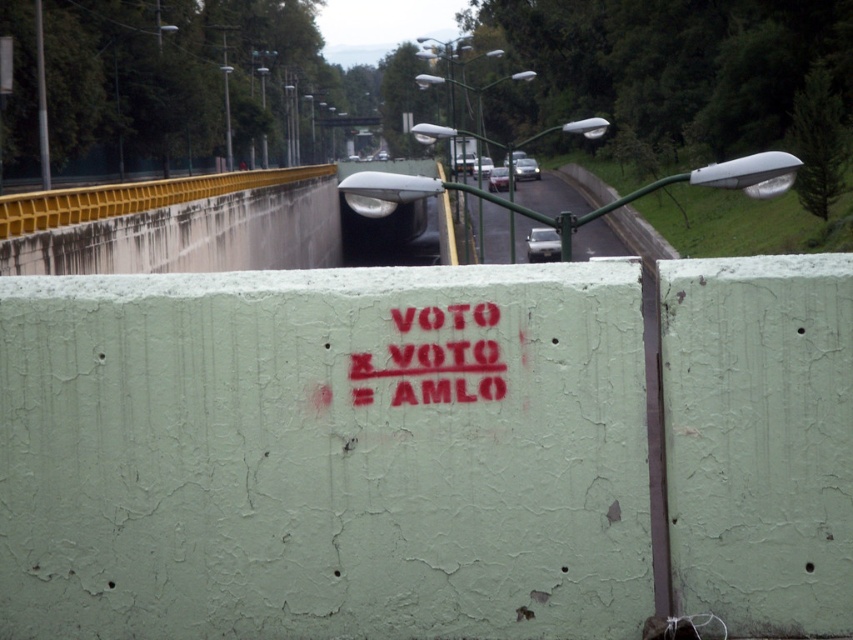
You are a delivery driver approaching the intersection where the green concrete wall at center and the gray asphalt road at center are located. You need to determine which object is closer to the road surface. Which one is closer?

The green concrete wall at center is shorter than the gray asphalt road at center, so the green concrete wall at center is closer to the road surface.

You are a city planner analyzing a street scene. The scene includes a green concrete wall at center and a gray asphalt road at center. Which of these two objects occupies a larger area in the image?

The gray asphalt road at center occupies a larger area in the image compared to the green concrete wall at center, as the green concrete wall at center has a smaller size compared to the gray asphalt road at center.

You are a city planner analyzing the image. The green concrete wall at center and the gray asphalt road at center are both part of the urban landscape. Based on their widths, which one is narrower?

The green concrete wall at center is narrower than the gray asphalt road at center because its width is less than the road.